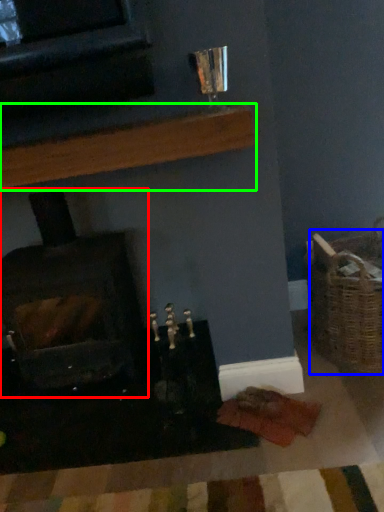
Question: Based on their relative distances, which object is nearer to wood burning stove (highlighted by a red box)? Choose from basket (highlighted by a blue box) and shelf (highlighted by a green box).

Choices:
 (A) basket
 (B) shelf

Answer: (B)